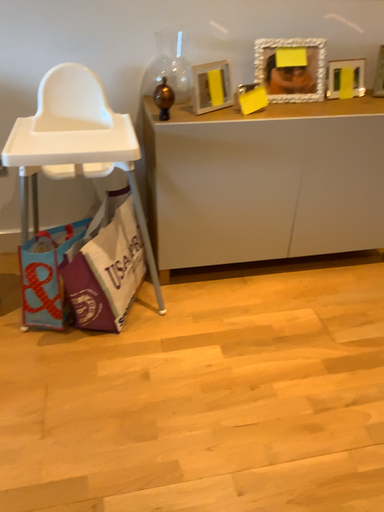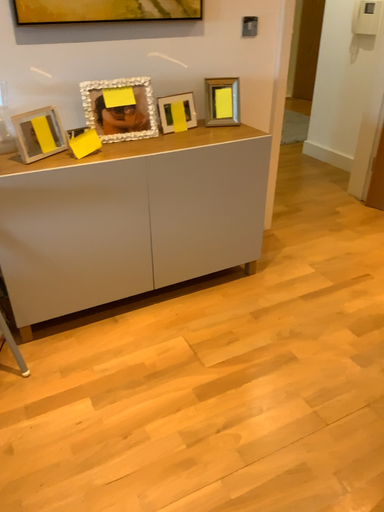
Question: Which way did the camera rotate in the video?

Choices:
 (A) rotated left
 (B) rotated right

Answer: (B)